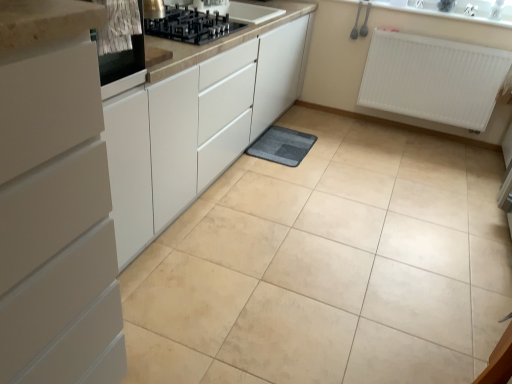
This screenshot has height=384, width=512. Describe the element at coordinates (123, 65) in the screenshot. I see `metallic stainless steel oven at upper left` at that location.

Describe the element at coordinates (282, 146) in the screenshot. This screenshot has height=384, width=512. I see `gray soft mat at center` at that location.

The width and height of the screenshot is (512, 384). What do you see at coordinates (55, 201) in the screenshot? I see `white matte cabinet at left` at bounding box center [55, 201].

Locate an element on the screen. The image size is (512, 384). metallic stainless steel oven at upper left is located at coordinates (123, 65).

Which object is closer to the camera, metallic stainless steel oven at upper left or white plastic radiator at upper right?

metallic stainless steel oven at upper left.

Is metallic stainless steel oven at upper left directly adjacent to white plastic radiator at upper right?

There is a gap between metallic stainless steel oven at upper left and white plastic radiator at upper right.

From the image's perspective, does metallic stainless steel oven at upper left appear higher than white plastic radiator at upper right?

No.

Considering the relative sizes of metallic stainless steel oven at upper left and white plastic radiator at upper right in the image provided, is metallic stainless steel oven at upper left taller than white plastic radiator at upper right?

In fact, metallic stainless steel oven at upper left may be shorter than white plastic radiator at upper right.

From a real-world perspective, which object stands above the other?

In real-world perspective, white plastic radiator at upper right is above.

From the image's perspective, who appears lower, white plastic radiator at upper right or gray soft mat at center?

gray soft mat at center.

How many degrees apart are the facing directions of white plastic radiator at upper right and gray soft mat at center?

The angle between the facing direction of white plastic radiator at upper right and the facing direction of gray soft mat at center is 90 degrees.

Considering the sizes of objects white plastic radiator at upper right and gray soft mat at center in the image provided, who is smaller, white plastic radiator at upper right or gray soft mat at center?

gray soft mat at center is smaller.

Which of these two, black glass gas stove at upper center or white matte cabinet at left, stands taller?

white matte cabinet at left.

From the image's perspective, is black glass gas stove at upper center beneath white matte cabinet at left?

Incorrect, from the image's perspective, black glass gas stove at upper center is higher than white matte cabinet at left.

Consider the image. Is white matte cabinet at left a part of black glass gas stove at upper center?

Definitely not — white matte cabinet at left is not inside black glass gas stove at upper center.

Is black glass gas stove at upper center positioned behind white matte cabinet at left?

Yes.

Which object is wider, gray soft mat at center or white matte cabinet at left?

Wider between the two is white matte cabinet at left.

Considering the positions of point (303, 147) and point (40, 204), is point (303, 147) closer or farther from the camera than point (40, 204)?

Point (303, 147) appears to be farther away from the viewer than point (40, 204).

From the image's perspective, which is below, gray soft mat at center or white matte cabinet at left?

white matte cabinet at left appears lower in the image.

Based on the photo, is white matte cabinet at left at the back of gray soft mat at center?

gray soft mat at center does not have its back to white matte cabinet at left.

Does white plastic radiator at upper right contain metallic stainless steel oven at upper left?

No, white plastic radiator at upper right does not contain metallic stainless steel oven at upper left.

From the picture: From a real-world perspective, which object stands above the other?

metallic stainless steel oven at upper left, from a real-world perspective.

Image resolution: width=512 pixels, height=384 pixels. Identify the location of home appliance lying in front of the white plastic radiator at upper right. (123, 65).

Consider the image. Is white plastic radiator at upper right at the left side of metallic stainless steel oven at upper left?

No, white plastic radiator at upper right is not to the left of metallic stainless steel oven at upper left.

Is black glass gas stove at upper center thinner than metallic stainless steel oven at upper left?

In fact, black glass gas stove at upper center might be wider than metallic stainless steel oven at upper left.

Is black glass gas stove at upper center positioned far away from metallic stainless steel oven at upper left?

No, black glass gas stove at upper center is not far from metallic stainless steel oven at upper left.

Based on the photo, is black glass gas stove at upper center to the left of metallic stainless steel oven at upper left from the viewer's perspective?

In fact, black glass gas stove at upper center is to the right of metallic stainless steel oven at upper left.

Can you tell me how much black glass gas stove at upper center and metallic stainless steel oven at upper left differ in facing direction?

The facing directions of black glass gas stove at upper center and metallic stainless steel oven at upper left are 0.497 degrees apart.

At what (x,y) coordinates should I click in order to perform the action: click on bath mat located on the right of black glass gas stove at upper center. Please return your answer as a coordinate pair (x, y). The image size is (512, 384). Looking at the image, I should click on (282, 146).

Is black glass gas stove at upper center positioned far away from gray soft mat at center?

Yes, black glass gas stove at upper center is far from gray soft mat at center.

Is black glass gas stove at upper center looking in the opposite direction of gray soft mat at center?

black glass gas stove at upper center is not turned away from gray soft mat at center.

Locate an element on the screen. radiator beneath the metallic stainless steel oven at upper left (from a real-world perspective) is located at coordinates (433, 79).

Identify the location of bath mat that is on the left side of white plastic radiator at upper right. (282, 146).

Based on their spatial positions, is metallic stainless steel oven at upper left or white plastic radiator at upper right further from white matte cabinet at left?

white plastic radiator at upper right is positioned further to the anchor white matte cabinet at left.

Looking at the image, which one is located closer to black glass gas stove at upper center, metallic stainless steel oven at upper left or gray soft mat at center?

The object closer to black glass gas stove at upper center is metallic stainless steel oven at upper left.

When comparing their distances from black glass gas stove at upper center, does gray soft mat at center or white matte cabinet at left seem further?

white matte cabinet at left lies further to black glass gas stove at upper center than the other object.

Considering their positions, is black glass gas stove at upper center positioned closer to white plastic radiator at upper right than white matte cabinet at left?

The object closer to white plastic radiator at upper right is black glass gas stove at upper center.

From the image, which object appears to be farther from metallic stainless steel oven at upper left, gray soft mat at center or white plastic radiator at upper right?

white plastic radiator at upper right lies further to metallic stainless steel oven at upper left than the other object.

In the scene shown: Considering their positions, is white matte cabinet at left positioned further to metallic stainless steel oven at upper left than gray soft mat at center?

gray soft mat at center is further to metallic stainless steel oven at upper left.

Looking at the image, which one is located further to white plastic radiator at upper right, gray soft mat at center or black glass gas stove at upper center?

black glass gas stove at upper center lies further to white plastic radiator at upper right than the other object.

From the image, which object appears to be farther from black glass gas stove at upper center, gray soft mat at center or white plastic radiator at upper right?

Based on the image, white plastic radiator at upper right appears to be further to black glass gas stove at upper center.

Locate an element on the screen. Image resolution: width=512 pixels, height=384 pixels. home appliance between white matte cabinet at left and gray soft mat at center from front to back is located at coordinates (123, 65).

The height and width of the screenshot is (384, 512). What are the coordinates of `gas stove positioned between white matte cabinet at left and white plastic radiator at upper right from near to far` in the screenshot? It's located at (191, 25).

You are a GUI agent. You are given a task and a screenshot of the screen. Output one action in this format:
    pyautogui.click(x=<x>, y=<y>)
    Task: Click on the gas stove between metallic stainless steel oven at upper left and gray soft mat at center in the front-back direction
    
    Given the screenshot: What is the action you would take?
    pyautogui.click(x=191, y=25)

The height and width of the screenshot is (384, 512). I want to click on bath mat located between white matte cabinet at left and white plastic radiator at upper right in the depth direction, so click(282, 146).